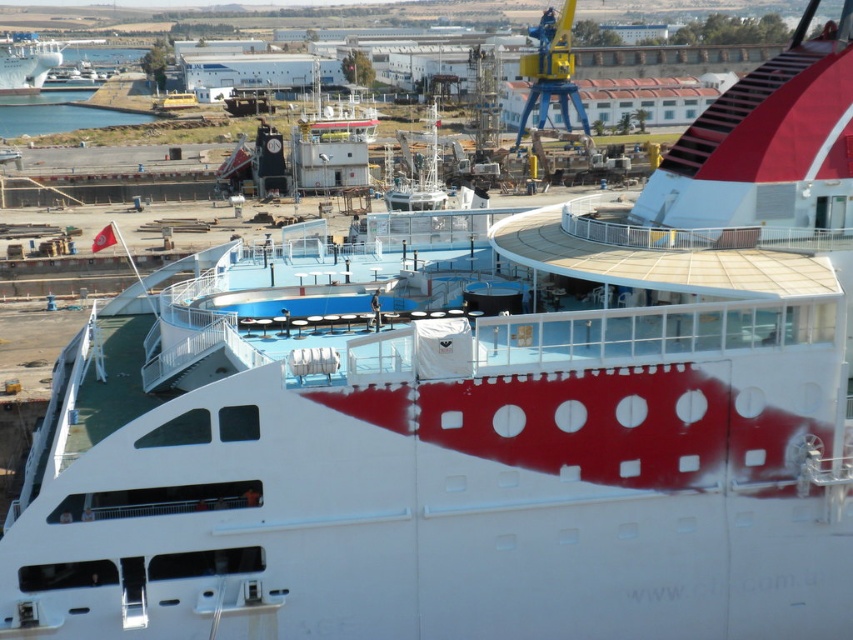
Question: Is blue water at lower left wider than white glossy ship at upper left?

Choices:
 (A) yes
 (B) no

Answer: (A)

Question: From the image, what is the correct spatial relationship of blue water at lower left in relation to white glossy ship at upper left?

Choices:
 (A) below
 (B) above

Answer: (A)

Question: Among these points, which one is nearest to the camera?

Choices:
 (A) (99, 124)
 (B) (35, 67)

Answer: (A)

Question: Which point is farther to the camera?

Choices:
 (A) blue water at lower left
 (B) white glossy ship at upper left

Answer: (B)

Question: Can you confirm if blue water at lower left is positioned below white glossy ship at upper left?

Choices:
 (A) yes
 (B) no

Answer: (A)

Question: Among these objects, which one is farthest from the camera?

Choices:
 (A) blue water at lower left
 (B) white glossy ship at upper left

Answer: (B)